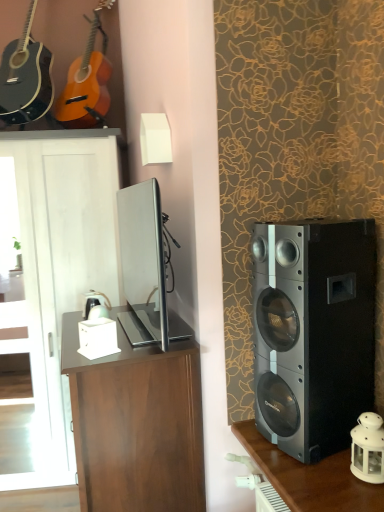
You are a GUI agent. You are given a task and a screenshot of the screen. Output one action in this format:
    pyautogui.click(x=<x>, y=<y>)
    Task: Click on the free space on the front side of black metallic speaker at right
    
    Given the screenshot: What is the action you would take?
    pyautogui.click(x=323, y=480)